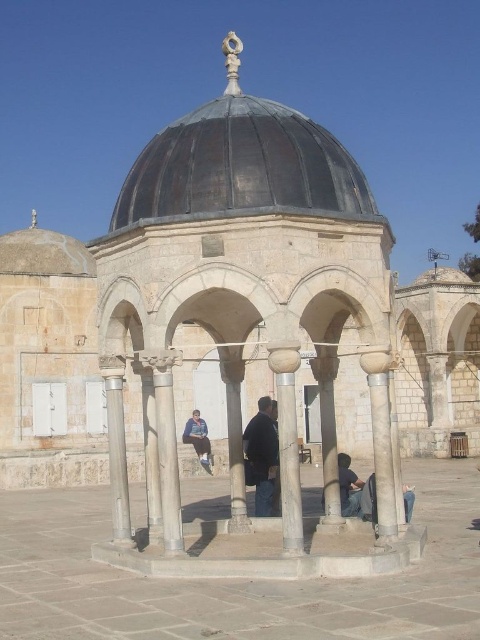
Which is above, black matte jacket at center or dark blue jeans at center?

Positioned higher is black matte jacket at center.

From the picture: Is black matte jacket at center positioned at the back of dark blue jeans at center?

Yes.

What do you see at coordinates (263, 454) in the screenshot? The height and width of the screenshot is (640, 480). I see `black matte jacket at center` at bounding box center [263, 454].

Image resolution: width=480 pixels, height=640 pixels. I want to click on black matte jacket at center, so click(263, 454).

Does rusty metal dome at center appear under gray stone column at center?

No, rusty metal dome at center is not below gray stone column at center.

Is rusty metal dome at center thinner than gray stone column at center?

No.

Which is in front, point (206, 196) or point (129, 520)?

Point (206, 196) is more forward.

Find the location of a particular element. Image resolution: width=480 pixels, height=640 pixels. rusty metal dome at center is located at coordinates (241, 164).

Is point (332, 177) closer to viewer compared to point (349, 504)?

Yes, point (332, 177) is closer to viewer.

Can you confirm if rusty metal dome at center is positioned above dark blue jeans at center?

Yes, rusty metal dome at center is above dark blue jeans at center.

Describe the element at coordinates (241, 164) in the screenshot. I see `rusty metal dome at center` at that location.

The width and height of the screenshot is (480, 640). Find the location of `rusty metal dome at center`. rusty metal dome at center is located at coordinates (241, 164).